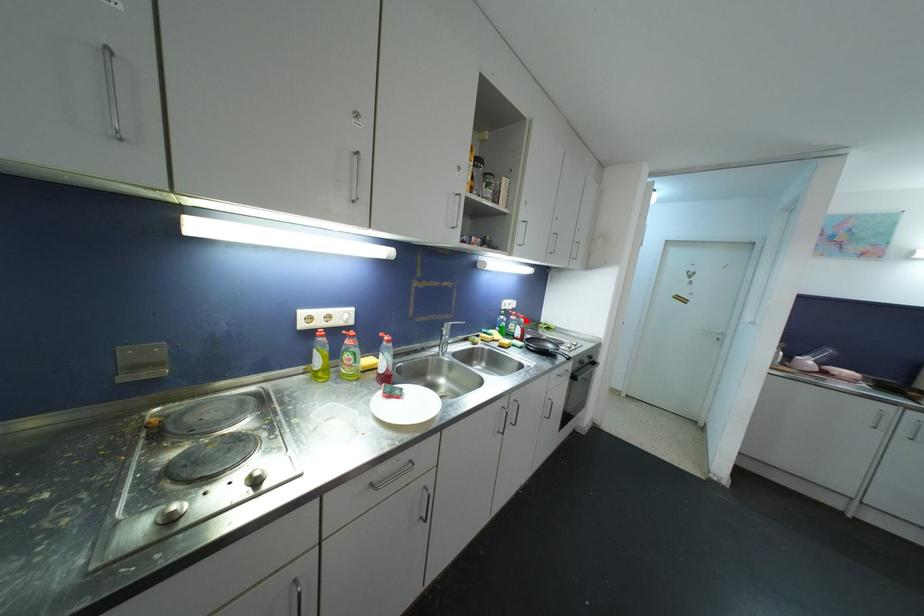
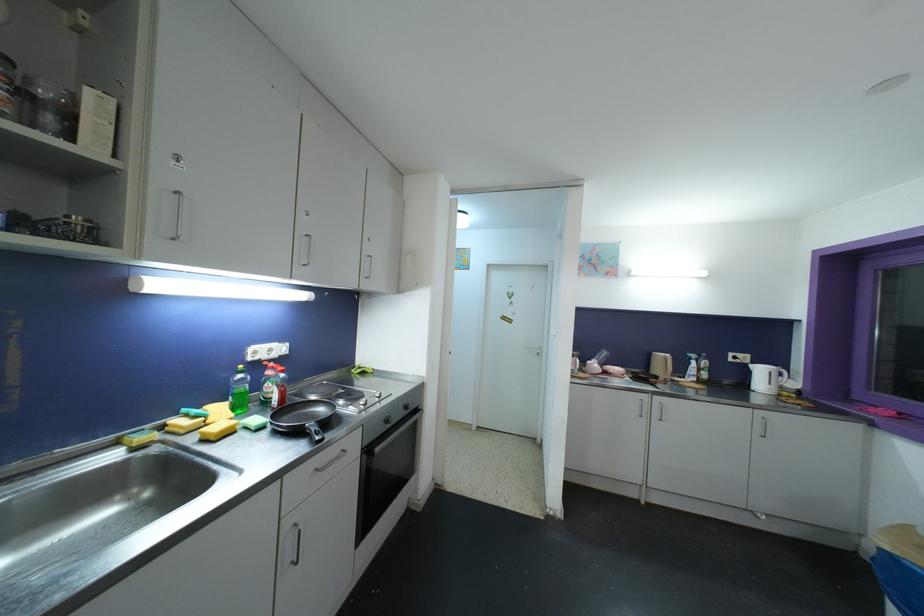
In the second image, find the point that corresponds to the highlighted location in the first image.

(286, 374)